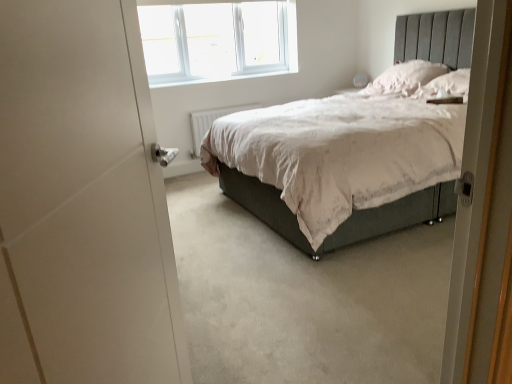
Question: From the image's perspective, does pink fabric pillow at upper right, which is the 1th pillow in back-to-front order, appear higher than white soft pillow at upper right, marked as the 2th pillow in a back-to-front arrangement?

Choices:
 (A) yes
 (B) no

Answer: (A)

Question: Can you confirm if pink fabric pillow at upper right, which is counted as the second pillow, starting from the front, is taller than white soft pillow at upper right, marked as the 2th pillow in a back-to-front arrangement?

Choices:
 (A) no
 (B) yes

Answer: (B)

Question: Can you confirm if pink fabric pillow at upper right, which is counted as the second pillow, starting from the front, is positioned to the left of white soft pillow at upper right, marked as the 2th pillow in a back-to-front arrangement?

Choices:
 (A) no
 (B) yes

Answer: (B)

Question: Does pink fabric pillow at upper right, which is the 1th pillow in back-to-front order, come behind white soft pillow at upper right, which is the first pillow in front-to-back order?

Choices:
 (A) yes
 (B) no

Answer: (A)

Question: Considering the relative sizes of pink fabric pillow at upper right, which is counted as the second pillow, starting from the front, and white soft pillow at upper right, marked as the 2th pillow in a back-to-front arrangement, in the image provided, is pink fabric pillow at upper right, which is counted as the second pillow, starting from the front, bigger than white soft pillow at upper right, marked as the 2th pillow in a back-to-front arrangement,?

Choices:
 (A) no
 (B) yes

Answer: (B)

Question: Is there a large distance between pink fabric pillow at upper right, which is the 1th pillow in back-to-front order, and white soft pillow at upper right, marked as the 2th pillow in a back-to-front arrangement?

Choices:
 (A) no
 (B) yes

Answer: (A)

Question: From the image's perspective, would you say white plastic window at upper center is positioned over white matte door at left?

Choices:
 (A) yes
 (B) no

Answer: (A)

Question: Would you say white plastic window at upper center is a long distance from white matte door at left?

Choices:
 (A) no
 (B) yes

Answer: (B)

Question: Is the depth of white plastic window at upper center less than that of white matte door at left?

Choices:
 (A) no
 (B) yes

Answer: (A)

Question: Can you confirm if white plastic window at upper center is bigger than white matte door at left?

Choices:
 (A) no
 (B) yes

Answer: (A)

Question: Is white plastic window at upper center next to white matte door at left and touching it?

Choices:
 (A) no
 (B) yes

Answer: (A)

Question: Is white plastic window at upper center oriented towards white matte door at left?

Choices:
 (A) yes
 (B) no

Answer: (A)

Question: Is pink fabric pillow at upper right, which is counted as the second pillow, starting from the front, at the right side of white matte door at left?

Choices:
 (A) no
 (B) yes

Answer: (B)